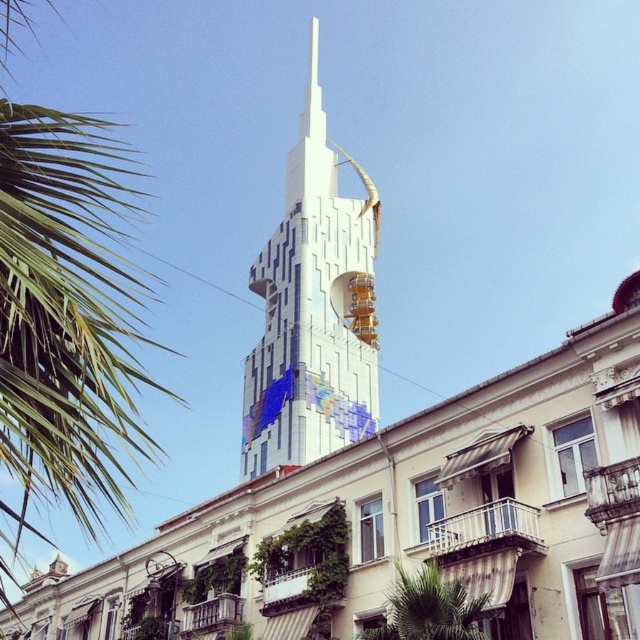
Question: Is green leafy palm tree at upper left wider than green leafy palm tree at lower center?

Choices:
 (A) no
 (B) yes

Answer: (B)

Question: Which object is farther from the camera taking this photo?

Choices:
 (A) green leafy palm tree at upper left
 (B) white glossy bell tower at center
 (C) green leafy palm tree at lower center

Answer: (B)

Question: Which of the following is the closest to the observer?

Choices:
 (A) white glossy bell tower at center
 (B) green leafy palm tree at upper left

Answer: (B)

Question: Where is green leafy palm tree at upper left located in relation to white glossy bell tower at center in the image?

Choices:
 (A) right
 (B) left

Answer: (B)

Question: Which object is farther from the camera taking this photo?

Choices:
 (A) green leafy palm tree at upper left
 (B) white glossy bell tower at center
 (C) green leafy palm tree at lower center

Answer: (B)

Question: Can you confirm if white glossy bell tower at center is thinner than green leafy palm tree at lower center?

Choices:
 (A) no
 (B) yes

Answer: (A)